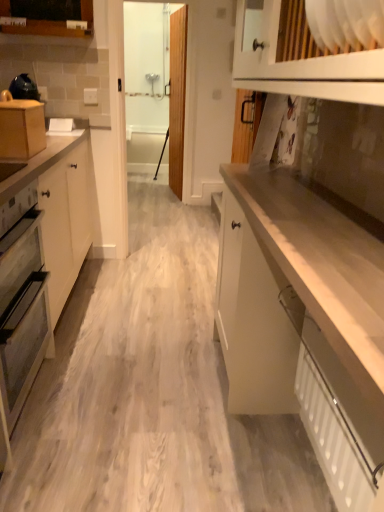
Locate an element on the screen. vacant space behind matte gray oven at left is located at coordinates (87, 341).